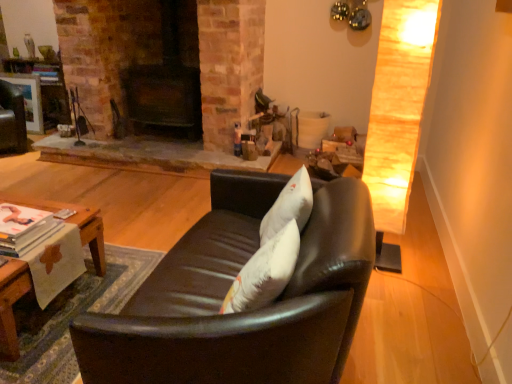
The width and height of the screenshot is (512, 384). Describe the element at coordinates (12, 304) in the screenshot. I see `woodenwoodentable at lower left` at that location.

In order to face matte black swivel chair at upper left, should I rotate leftwards or rightwards?

You should rotate left by 30.462 degrees.

Find the location of `woodenwoodentable at lower left`. woodenwoodentable at lower left is located at coordinates (12, 304).

Based on the photo, is woodenwoodentable at lower left a part of matte black swivel chair at upper left?

No, woodenwoodentable at lower left is not surrounded by matte black swivel chair at upper left.

Is point (24, 113) closer or farther from the camera than point (5, 311)?

Point (24, 113).

Locate an element on the screen. swivel chair lying on the left of woodenwoodentable at lower left is located at coordinates (12, 120).

Between matte black swivel chair at upper left and woodenwoodentable at lower left, which one is positioned behind?

matte black swivel chair at upper left is more distant.

Considering the sizes of objects black leather couch at center and matte black swivel chair at upper left in the image provided, who is bigger, black leather couch at center or matte black swivel chair at upper left?

With larger size is black leather couch at center.

Can you confirm if black leather couch at center is wider than matte black swivel chair at upper left?

Yes, black leather couch at center is wider than matte black swivel chair at upper left.

This screenshot has width=512, height=384. There is a matte black swivel chair at upper left. Find the location of `studio couch above it (from a real-world perspective)`. studio couch above it (from a real-world perspective) is located at coordinates (227, 290).

Is the depth of black leather couch at center greater than that of matte black swivel chair at upper left?

No, it is in front of matte black swivel chair at upper left.

Between matte black swivel chair at upper left and black leather couch at center, which one has more height?

With more height is black leather couch at center.

Is matte black swivel chair at upper left wider than black leather couch at center?

No.

From the image's perspective, is matte black swivel chair at upper left under black leather couch at center?

No, from the image's perspective, matte black swivel chair at upper left is not beneath black leather couch at center.

Is matte black swivel chair at upper left to the left or to the right of black leather couch at center in the image?

matte black swivel chair at upper left is positioned on black leather couch at center's left side.

Does woodenwoodentable at lower left touch black leather couch at center?

No, woodenwoodentable at lower left is not touching black leather couch at center.

You are a GUI agent. You are given a task and a screenshot of the screen. Output one action in this format:
    pyautogui.click(x=<x>, y=<y>)
    Task: Click on the studio couch on the right of the woodenwoodentable at lower left
    Image resolution: width=512 pixels, height=384 pixels.
    Given the screenshot: What is the action you would take?
    pyautogui.click(x=227, y=290)

In the scene shown: Which object is positioned more to the right, woodenwoodentable at lower left or black leather couch at center?

black leather couch at center.

Would you say woodenwoodentable at lower left contains black leather couch at center?

No, black leather couch at center is not inside woodenwoodentable at lower left.

Can you confirm if woodenwoodentable at lower left is smaller than matte black swivel chair at upper left?

No, woodenwoodentable at lower left is not smaller than matte black swivel chair at upper left.

Which is correct: woodenwoodentable at lower left is inside matte black swivel chair at upper left, or outside of it?

woodenwoodentable at lower left cannot be found inside matte black swivel chair at upper left.

Does woodenwoodentable at lower left touch matte black swivel chair at upper left?

No, woodenwoodentable at lower left is not next to matte black swivel chair at upper left.

How much distance is there between woodenwoodentable at lower left and matte black swivel chair at upper left?

The distance of woodenwoodentable at lower left from matte black swivel chair at upper left is 3.00 meters.

At what (x,y) coordinates should I click in order to perform the action: click on studio couch in front of the woodenwoodentable at lower left. Please return your answer as a coordinate pair (x, y). The width and height of the screenshot is (512, 384). Looking at the image, I should click on (227, 290).

From the image's perspective, between black leather couch at center and woodenwoodentable at lower left, which one is located above?

black leather couch at center appears higher in the image.

Would you consider black leather couch at center to be distant from woodenwoodentable at lower left?

They are positioned close to each other.

Considering the points (319, 234) and (81, 224), which point is in front, point (319, 234) or point (81, 224)?

The point (319, 234) is closer to the camera.

Image resolution: width=512 pixels, height=384 pixels. Find the location of `swivel chair positioned vertically above the woodenwoodentable at lower left (from a real-world perspective)`. swivel chair positioned vertically above the woodenwoodentable at lower left (from a real-world perspective) is located at coordinates (12, 120).

This screenshot has height=384, width=512. What are the coordinates of `swivel chair behind the black leather couch at center` in the screenshot? It's located at coord(12,120).

Looking at the image, which one is located closer to woodenwoodentable at lower left, black leather couch at center or matte black swivel chair at upper left?

black leather couch at center lies closer to woodenwoodentable at lower left than the other object.

Based on their spatial positions, is black leather couch at center or woodenwoodentable at lower left further from matte black swivel chair at upper left?

black leather couch at center.

Considering their positions, is woodenwoodentable at lower left positioned further to matte black swivel chair at upper left than black leather couch at center?

The object further to matte black swivel chair at upper left is black leather couch at center.

From the image, which object appears to be nearer to black leather couch at center, matte black swivel chair at upper left or woodenwoodentable at lower left?

woodenwoodentable at lower left lies closer to black leather couch at center than the other object.

When comparing their distances from black leather couch at center, does woodenwoodentable at lower left or matte black swivel chair at upper left seem further?

matte black swivel chair at upper left.

Which object lies further to the anchor point woodenwoodentable at lower left, matte black swivel chair at upper left or black leather couch at center?

matte black swivel chair at upper left is further to woodenwoodentable at lower left.

Where is `table between black leather couch at center and matte black swivel chair at upper left in the front-back direction`? This screenshot has height=384, width=512. table between black leather couch at center and matte black swivel chair at upper left in the front-back direction is located at coordinates (12, 304).